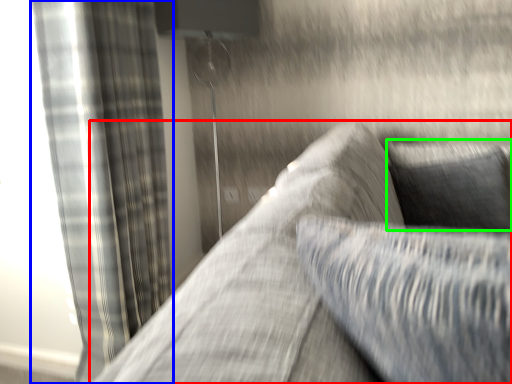
Question: Considering the real-world distances, which object is closest to studio couch (highlighted by a red box)? curtain (highlighted by a blue box) or pillow (highlighted by a green box).

Choices:
 (A) curtain
 (B) pillow

Answer: (B)